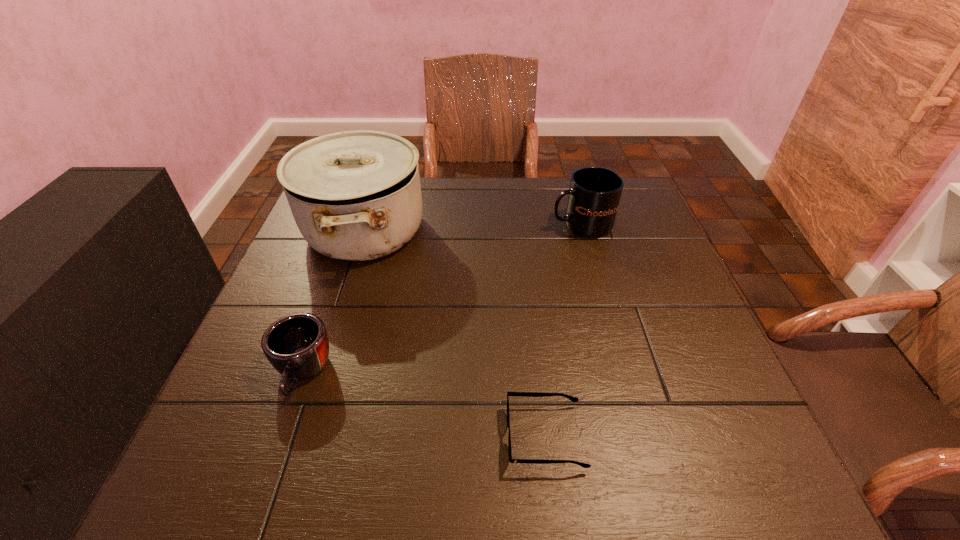
The height and width of the screenshot is (540, 960). In order to click on saucepan in this screenshot , I will do [355, 195].

Identify the location of the taller mug. Image resolution: width=960 pixels, height=540 pixels. (593, 197).

The image size is (960, 540). What are the coordinates of `the farther mug` in the screenshot? It's located at (593, 197).

You are a GUI agent. You are given a task and a screenshot of the screen. Output one action in this format:
    pyautogui.click(x=<x>, y=<y>)
    Task: Click on the nearer mug
    This screenshot has width=960, height=540.
    Given the screenshot: What is the action you would take?
    pyautogui.click(x=297, y=346)

In order to click on the left mug in this screenshot , I will do `click(297, 346)`.

The width and height of the screenshot is (960, 540). Find the location of `the shortest object`. the shortest object is located at coordinates (525, 394).

This screenshot has height=540, width=960. I want to click on spectacles, so click(525, 394).

The image size is (960, 540). What are the coordinates of `vacant space located on the front of the tallest object` in the screenshot? It's located at (308, 406).

You are a GUI agent. You are given a task and a screenshot of the screen. Output one action in this format:
    pyautogui.click(x=<x>, y=<y>)
    Task: Click on the vacant region located 0.110m with the handle on the side of the right mug
    The height and width of the screenshot is (540, 960).
    Given the screenshot: What is the action you would take?
    pyautogui.click(x=510, y=225)

This screenshot has width=960, height=540. I want to click on vacant space situated with the handle on the side of the right mug, so click(x=436, y=225).